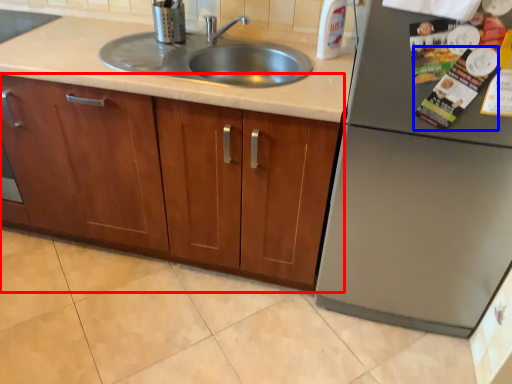
Question: Which object is further to the camera taking this photo, cabinetry (highlighted by a red box) or magazine (highlighted by a blue box)?

Choices:
 (A) cabinetry
 (B) magazine

Answer: (A)